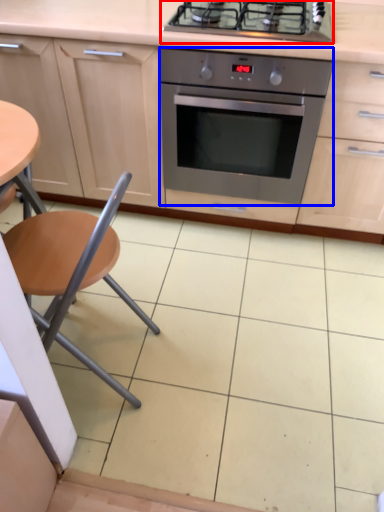
Question: Which point is further to the camera, gas stove (highlighted by a red box) or kitchen appliance (highlighted by a blue box)?

Choices:
 (A) gas stove
 (B) kitchen appliance

Answer: (B)